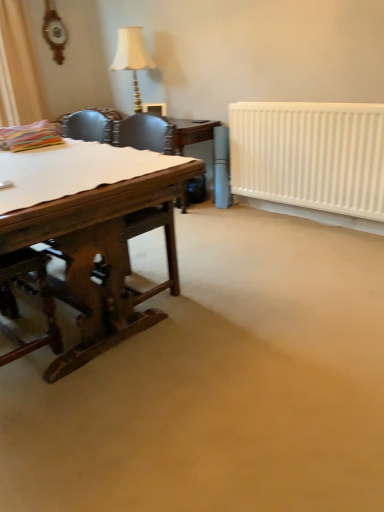
Question: Is white paper at left bigger or smaller than white matte radiator at right?

Choices:
 (A) big
 (B) small

Answer: (B)

Question: From the image's perspective, relative to white matte radiator at right, is white paper at left above or below?

Choices:
 (A) below
 (B) above

Answer: (A)

Question: Estimate the real-world distances between objects in this image. Which object is farther from the matte gold lamp at upper center?

Choices:
 (A) white paper at left
 (B) white matte radiator at right
 (C) brown wooden desk at left

Answer: (C)

Question: Which is nearer to the white paper at left?

Choices:
 (A) matte gold lamp at upper center
 (B) white matte radiator at right
 (C) brown wooden desk at left

Answer: (C)